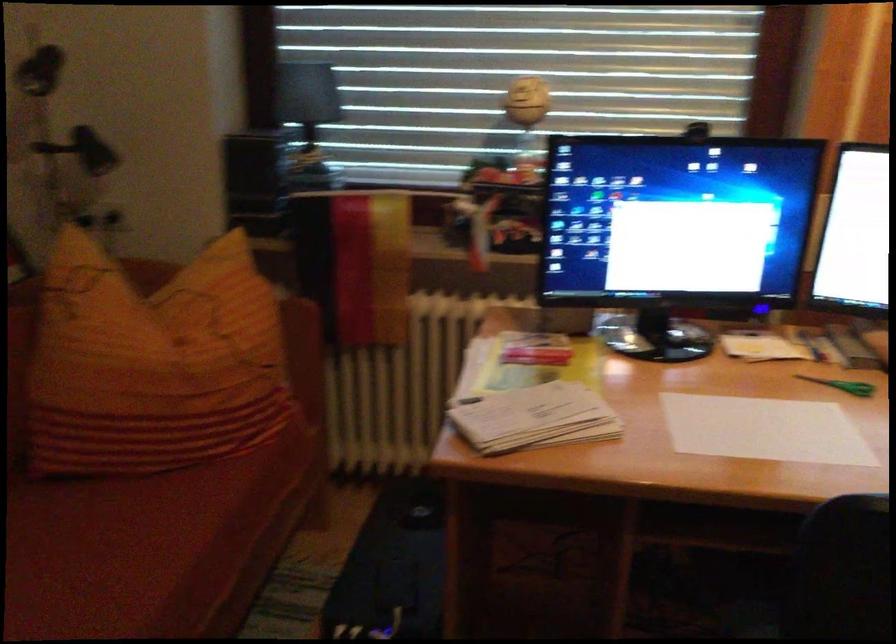
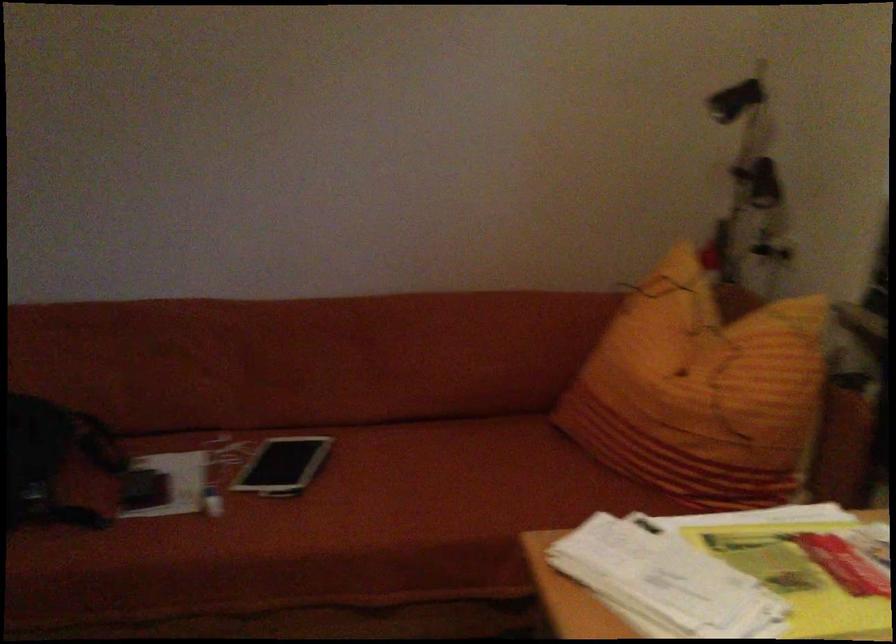
Question: The camera is either moving clockwise (left) or counter-clockwise (right) around the object. The first image is from the beginning of the video and the second image is from the end. Is the camera moving left or right when shooting the video?

Choices:
 (A) Left
 (B) Right

Answer: (B)